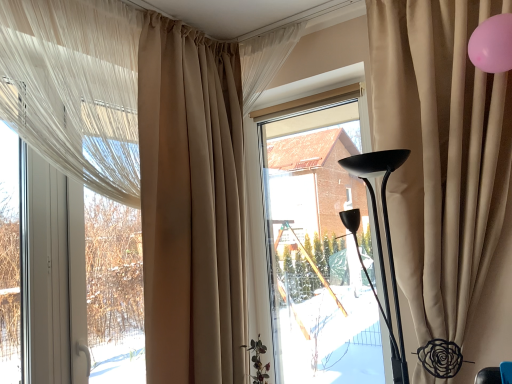
Question: From a real-world perspective, is beige fabric curtain at left, placed as the 3th curtain when sorted from right to left, beneath beige velvet curtain at right, acting as the 4th curtain starting from the left?

Choices:
 (A) no
 (B) yes

Answer: (B)

Question: Does beige fabric curtain at left, the 2th curtain when ordered from left to right, have a larger size compared to beige velvet curtain at right, acting as the 4th curtain starting from the left?

Choices:
 (A) yes
 (B) no

Answer: (B)

Question: Considering the relative sizes of beige fabric curtain at left, the 2th curtain when ordered from left to right, and beige velvet curtain at right, acting as the 4th curtain starting from the left, in the image provided, is beige fabric curtain at left, the 2th curtain when ordered from left to right, taller than beige velvet curtain at right, acting as the 4th curtain starting from the left,?

Choices:
 (A) yes
 (B) no

Answer: (A)

Question: Considering the relative sizes of beige fabric curtain at left, placed as the 3th curtain when sorted from right to left, and beige velvet curtain at right, acting as the 4th curtain starting from the left, in the image provided, is beige fabric curtain at left, placed as the 3th curtain when sorted from right to left, smaller than beige velvet curtain at right, acting as the 4th curtain starting from the left,?

Choices:
 (A) yes
 (B) no

Answer: (A)

Question: Considering the relative sizes of beige fabric curtain at left, placed as the 3th curtain when sorted from right to left, and beige velvet curtain at right, the 1th curtain positioned from the right, in the image provided, is beige fabric curtain at left, placed as the 3th curtain when sorted from right to left, thinner than beige velvet curtain at right, the 1th curtain positioned from the right,?

Choices:
 (A) no
 (B) yes

Answer: (A)

Question: From the image's perspective, is translucent white curtain at left, marked as the first curtain in a left-to-right arrangement, located above or below transparent glass window at center?

Choices:
 (A) above
 (B) below

Answer: (A)

Question: Is point (12, 79) closer or farther from the camera than point (377, 367)?

Choices:
 (A) closer
 (B) farther

Answer: (A)

Question: From a real-world perspective, is translucent white curtain at left, which is the fourth curtain in right-to-left order, physically located above or below transparent glass window at center?

Choices:
 (A) below
 (B) above

Answer: (B)

Question: From their relative heights in the image, would you say translucent white curtain at left, marked as the first curtain in a left-to-right arrangement, is taller or shorter than transparent glass window at center?

Choices:
 (A) tall
 (B) short

Answer: (B)

Question: From a real-world perspective, is transparent glass window at center physically located above or below beige velvet curtain at right, the 1th curtain positioned from the right?

Choices:
 (A) above
 (B) below

Answer: (B)

Question: Is transparent glass window at center inside the boundaries of beige velvet curtain at right, the 1th curtain positioned from the right, or outside?

Choices:
 (A) outside
 (B) inside

Answer: (A)

Question: Looking at the image, does transparent glass window at center seem bigger or smaller compared to beige velvet curtain at right, acting as the 4th curtain starting from the left?

Choices:
 (A) big
 (B) small

Answer: (B)

Question: Is transparent glass window at center in front of or behind beige velvet curtain at right, acting as the 4th curtain starting from the left, in the image?

Choices:
 (A) behind
 (B) front

Answer: (A)

Question: Looking at their shapes, would you say transparent glass window at center is wider or thinner than beige fabric curtain at upper center, which ranks as the 2th curtain in right-to-left order?

Choices:
 (A) thin
 (B) wide

Answer: (A)

Question: Is transparent glass window at center in front of or behind beige fabric curtain at upper center, acting as the third curtain starting from the left, in the image?

Choices:
 (A) behind
 (B) front

Answer: (A)